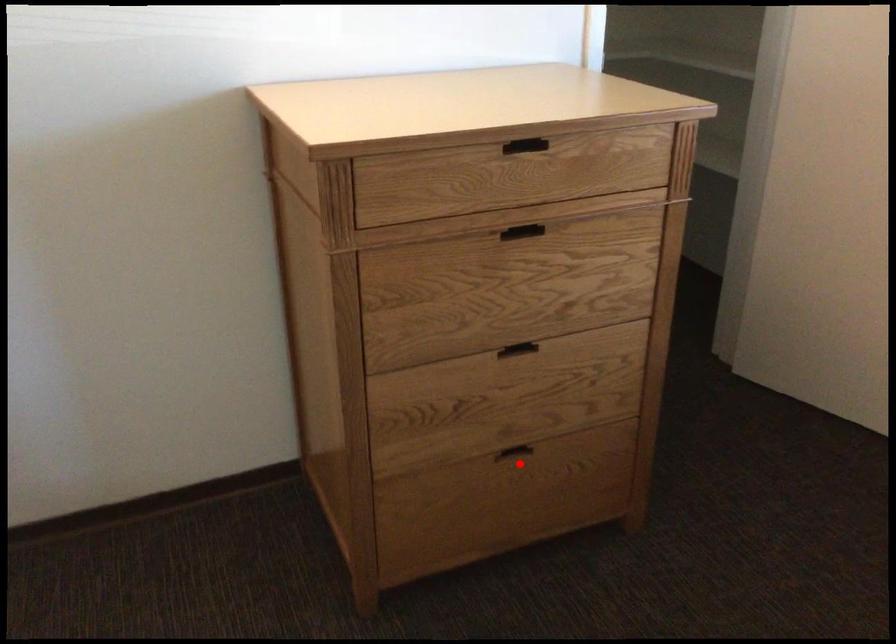
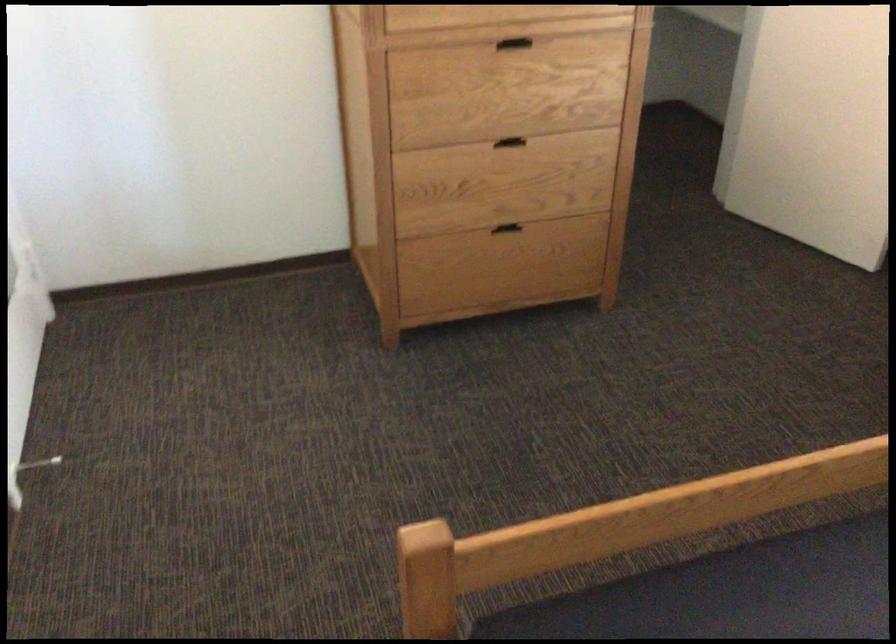
Where in the second image is the point corresponding to the highlighted location from the first image?

(510, 236)